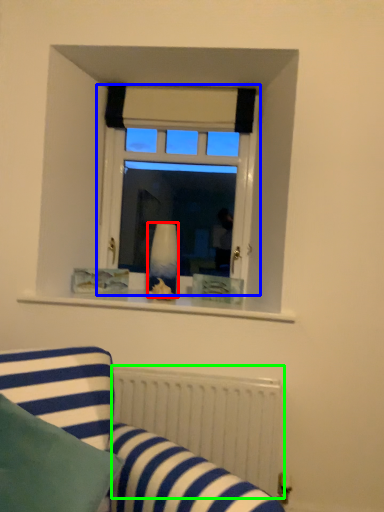
Question: Which is nearer to the vase (highlighted by a red box)? window (highlighted by a blue box) or radiator (highlighted by a green box).

Choices:
 (A) window
 (B) radiator

Answer: (A)